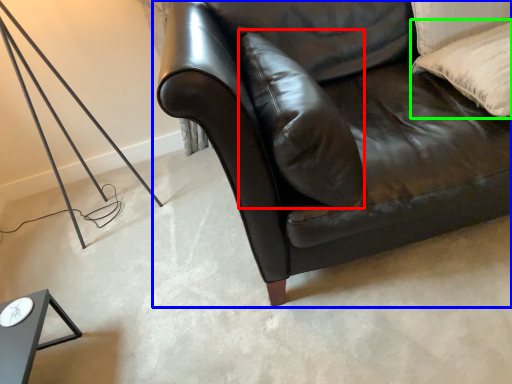
Question: Based on their relative distances, which object is farther from pillow (highlighted by a red box)? Choose from studio couch (highlighted by a blue box) and pillow (highlighted by a green box).

Choices:
 (A) studio couch
 (B) pillow

Answer: (B)